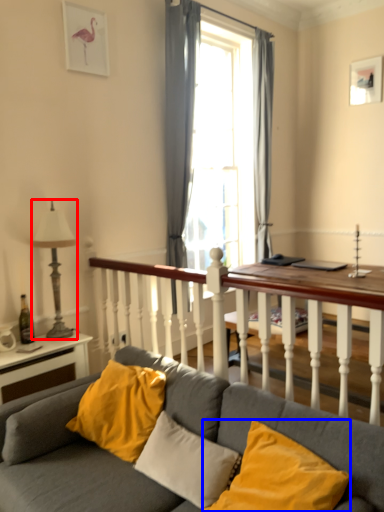
Question: Which object appears farthest to the camera in this image, lamp (highlighted by a red box) or pillow (highlighted by a blue box)?

Choices:
 (A) lamp
 (B) pillow

Answer: (A)